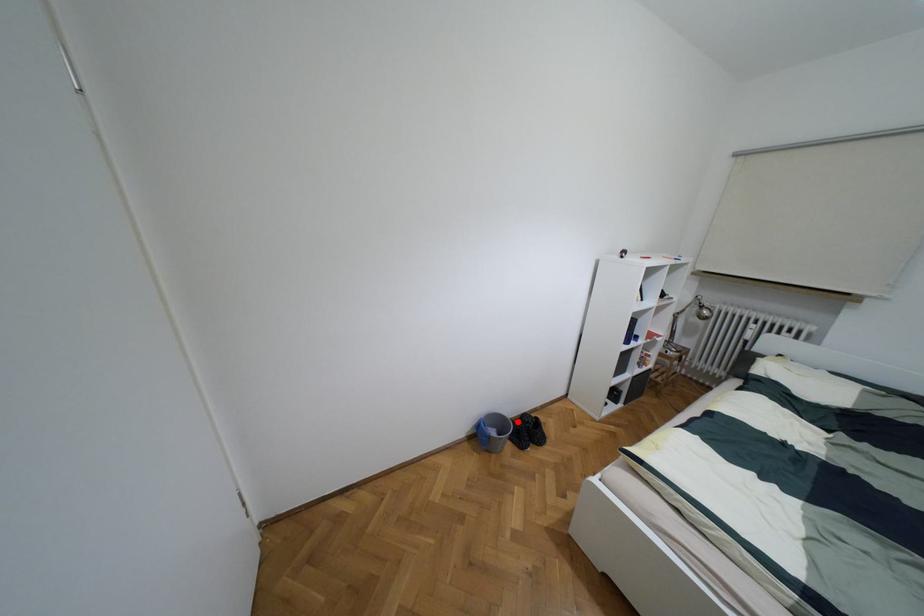
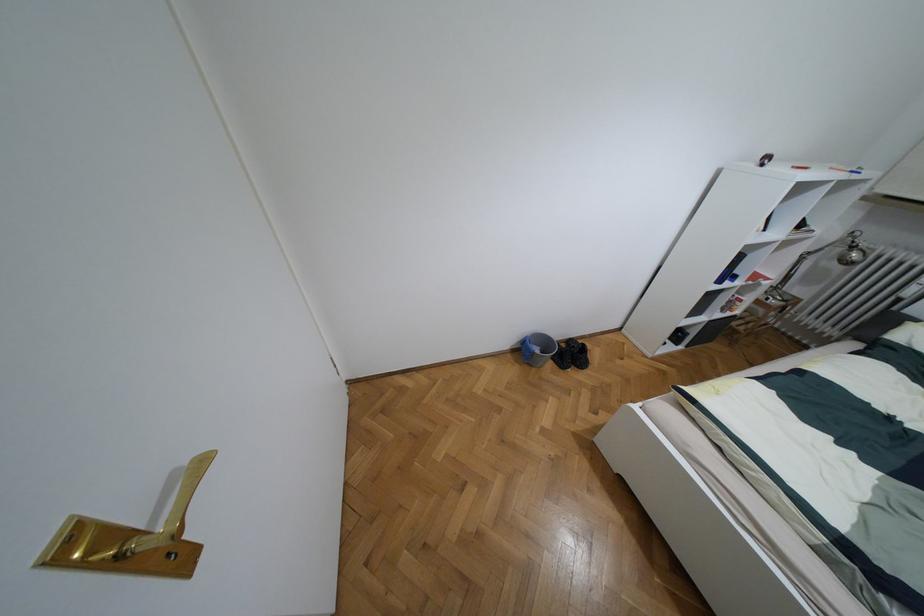
Question: I am providing you with two images of the same scene from different viewpoints. Image1 has a red point marked. In image2, the corresponding 3D location appears at what relative position? Reply with the corresponding letter.

Choices:
 (A) Closer
 (B) Farther

Answer: (B)